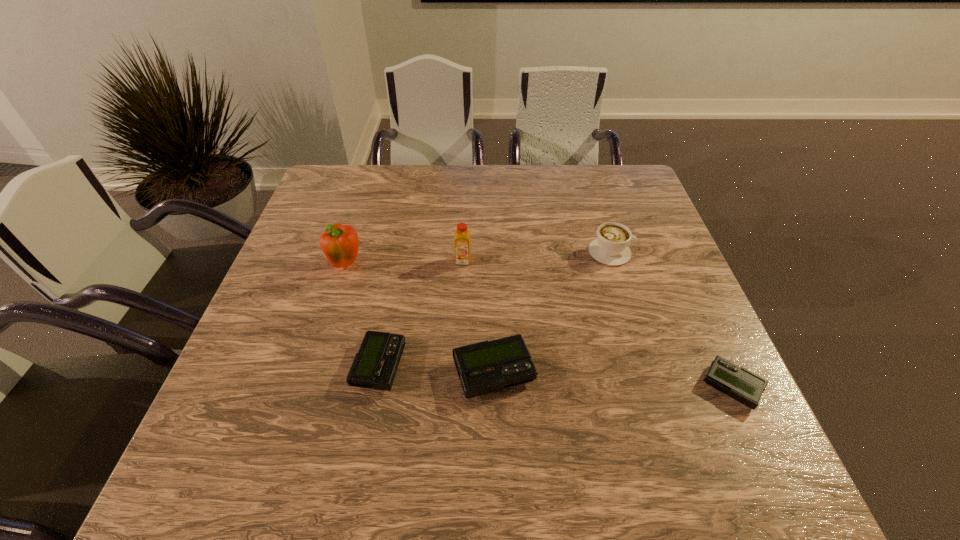
If we want them evenly spaced by inserting an extra beeper among them, please locate a free spot for this new beeper. Please provide its 2D coordinates. Your answer should be formatted as a tuple, i.e. [(x, y)], where the tuple contains the x and y coordinates of a point satisfying the conditions above.

[(612, 380)]